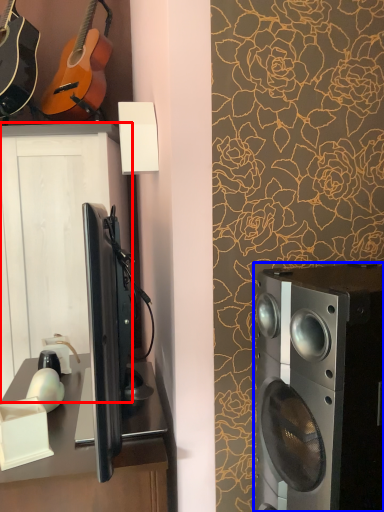
Question: Among these objects, which one is farthest to the camera, cabinetry (highlighted by a red box) or home appliance (highlighted by a blue box)?

Choices:
 (A) cabinetry
 (B) home appliance

Answer: (A)